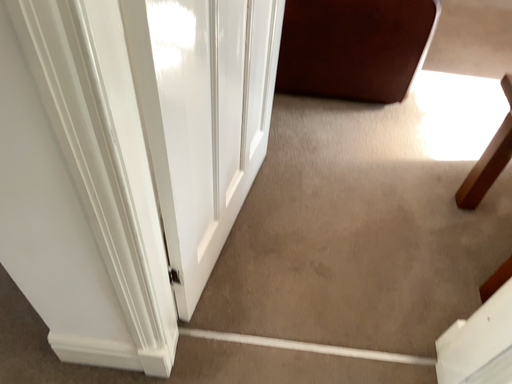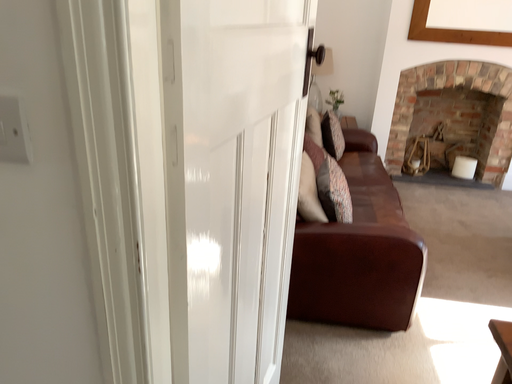
Question: Which way did the camera rotate in the video?

Choices:
 (A) rotated upward
 (B) rotated downward

Answer: (A)